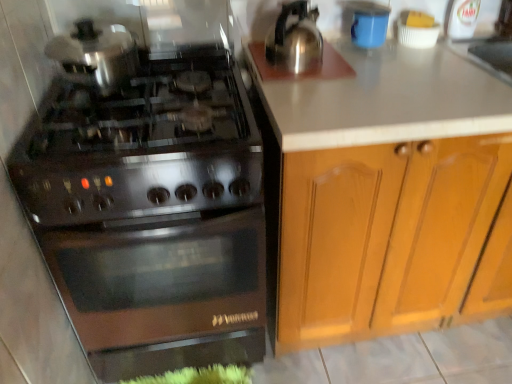
At what (x,y) coordinates should I click in order to perform the action: click on free space above stainless steel gas stove at left (from a real-world perspective). Please return your answer as a coordinate pair (x, y). Image resolution: width=512 pixels, height=384 pixels. Looking at the image, I should click on (145, 96).